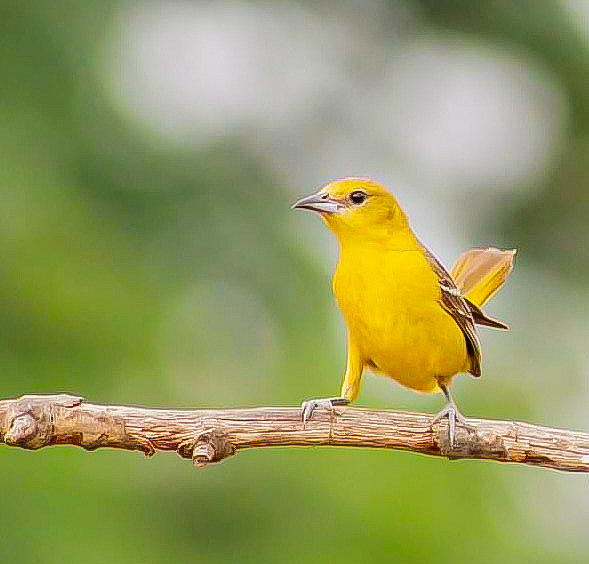
Locate an element on the screen. cracks in wood is located at coordinates (253, 418), (148, 416).